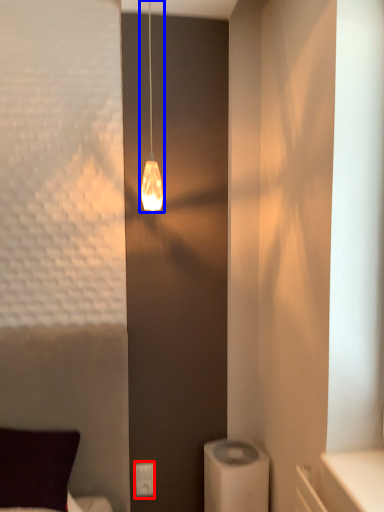
Question: Which of the following is the closest to the observer, light switch (highlighted by a red box) or lamp (highlighted by a blue box)?

Choices:
 (A) light switch
 (B) lamp

Answer: (B)